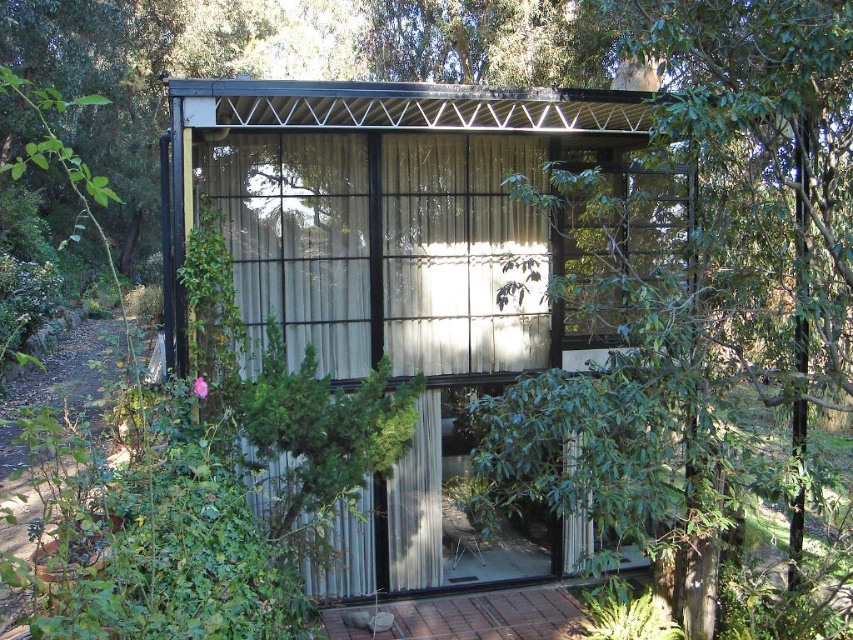
Is green leafy tree at center further to camera compared to metallic corrugated hut at center?

No, green leafy tree at center is in front of metallic corrugated hut at center.

Who is positioned more to the right, green leafy tree at center or metallic corrugated hut at center?

green leafy tree at center is more to the right.

The height and width of the screenshot is (640, 853). Describe the element at coordinates (701, 305) in the screenshot. I see `green leafy tree at center` at that location.

This screenshot has width=853, height=640. I want to click on green leafy tree at center, so click(x=701, y=305).